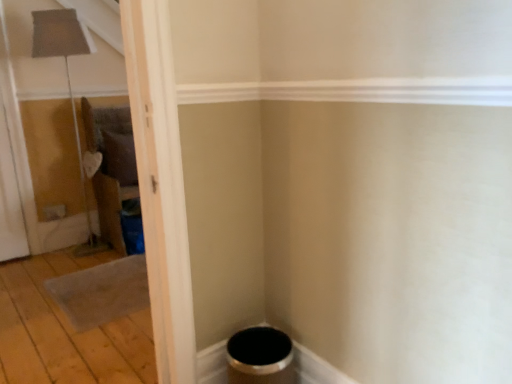
Question: Can you confirm if wooden floor at lower left is smaller than transparent plastic screen door at left?

Choices:
 (A) no
 (B) yes

Answer: (A)

Question: From the image's perspective, is wooden floor at lower left beneath transparent plastic screen door at left?

Choices:
 (A) no
 (B) yes

Answer: (B)

Question: Does wooden floor at lower left have a lesser width compared to transparent plastic screen door at left?

Choices:
 (A) no
 (B) yes

Answer: (A)

Question: Is the position of wooden floor at lower left less distant than that of transparent plastic screen door at left?

Choices:
 (A) yes
 (B) no

Answer: (A)

Question: Is wooden floor at lower left taller than transparent plastic screen door at left?

Choices:
 (A) yes
 (B) no

Answer: (B)

Question: Is wooden floor at lower left in contact with transparent plastic screen door at left?

Choices:
 (A) no
 (B) yes

Answer: (A)

Question: From a real-world perspective, does transparent plastic screen door at left sit lower than wooden floor at lower left?

Choices:
 (A) no
 (B) yes

Answer: (A)

Question: From the image's perspective, would you say transparent plastic screen door at left is positioned over wooden floor at lower left?

Choices:
 (A) no
 (B) yes

Answer: (B)

Question: Is transparent plastic screen door at left next to wooden floor at lower left?

Choices:
 (A) yes
 (B) no

Answer: (B)

Question: Is transparent plastic screen door at left positioned before wooden floor at lower left?

Choices:
 (A) yes
 (B) no

Answer: (B)

Question: Is wooden floor at lower left located within transparent plastic screen door at left?

Choices:
 (A) no
 (B) yes

Answer: (A)

Question: Is transparent plastic screen door at left outside of wooden floor at lower left?

Choices:
 (A) no
 (B) yes

Answer: (B)

Question: Do you think transparent plastic screen door at left is within wooden floor at lower left, or outside of it?

Choices:
 (A) inside
 (B) outside

Answer: (B)